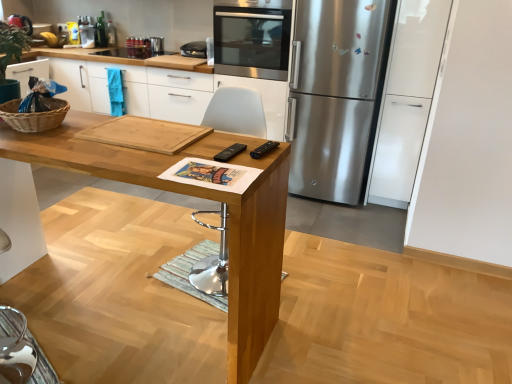
Question: From a real-world perspective, is woven brown basket at left physically below white plastic chair at center?

Choices:
 (A) no
 (B) yes

Answer: (A)

Question: Does woven brown basket at left have a greater width compared to white plastic chair at center?

Choices:
 (A) no
 (B) yes

Answer: (A)

Question: Does woven brown basket at left have a greater height compared to white plastic chair at center?

Choices:
 (A) no
 (B) yes

Answer: (A)

Question: Does woven brown basket at left turn towards white plastic chair at center?

Choices:
 (A) no
 (B) yes

Answer: (A)

Question: Does woven brown basket at left have a lesser width compared to white plastic chair at center?

Choices:
 (A) yes
 (B) no

Answer: (A)

Question: From the image's perspective, is natural wood cutting board at center above or below woven brown basket at left?

Choices:
 (A) above
 (B) below

Answer: (B)

Question: Looking at their shapes, would you say natural wood cutting board at center is wider or thinner than woven brown basket at left?

Choices:
 (A) wide
 (B) thin

Answer: (A)

Question: Relative to woven brown basket at left, is natural wood cutting board at center in front or behind?

Choices:
 (A) front
 (B) behind

Answer: (A)

Question: Considering the positions of natural wood cutting board at center and woven brown basket at left in the image, is natural wood cutting board at center bigger or smaller than woven brown basket at left?

Choices:
 (A) small
 (B) big

Answer: (A)

Question: Is point (271, 62) closer or farther from the camera than point (244, 122)?

Choices:
 (A) closer
 (B) farther

Answer: (B)

Question: Is stainless steel oven at upper center taller or shorter than white plastic chair at center?

Choices:
 (A) tall
 (B) short

Answer: (B)

Question: Is stainless steel oven at upper center wider or thinner than white plastic chair at center?

Choices:
 (A) wide
 (B) thin

Answer: (A)

Question: From a real-world perspective, is stainless steel oven at upper center physically located above or below white plastic chair at center?

Choices:
 (A) below
 (B) above

Answer: (B)

Question: Looking at their shapes, would you say natural wood cutting board at center is wider or thinner than natural wood cutting board at center?

Choices:
 (A) wide
 (B) thin

Answer: (B)

Question: Relative to natural wood cutting board at center, is natural wood cutting board at center in front or behind?

Choices:
 (A) behind
 (B) front

Answer: (B)